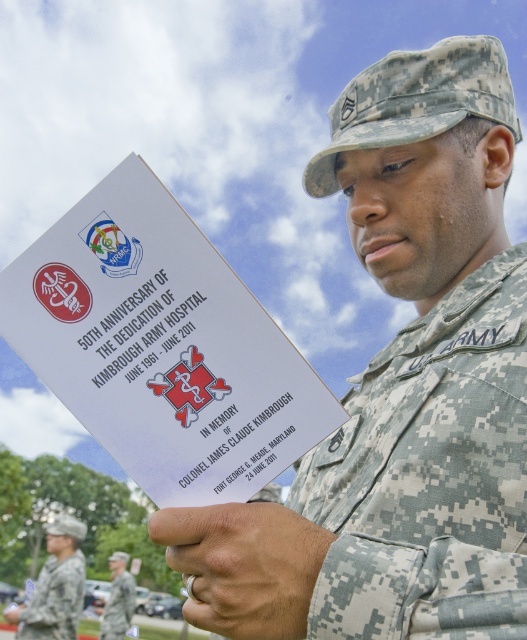
You are a photographer taking a picture of the soldier and the matte camouflage ring. Since the camouflage fabric us army uniform at center is blocking your view of the matte camouflage ring at lower center, where should you move to ensure both are visible?

Move to the side so the camouflage fabric us army uniform at center no longer blocks the matte camouflage ring at lower center.

You are an observer looking at the soldier in the scene. Which object is closer to you, the matte camouflage ring at lower center or the camouflage fabric uniform at center?

The matte camouflage ring at lower center is closer to you because it is positioned over the camouflage fabric uniform at center.

You are a photographer taking a picture of the soldier and the booklet. You need to ensure both the matte camouflage ring at lower center and the camouflage fabric uniform at center are in focus. Which object should you focus on first to ensure proper depth of field?

The matte camouflage ring at lower center is shorter than the camouflage fabric uniform at center, so you should focus on the camouflage fabric uniform at center first to ensure proper depth of field.